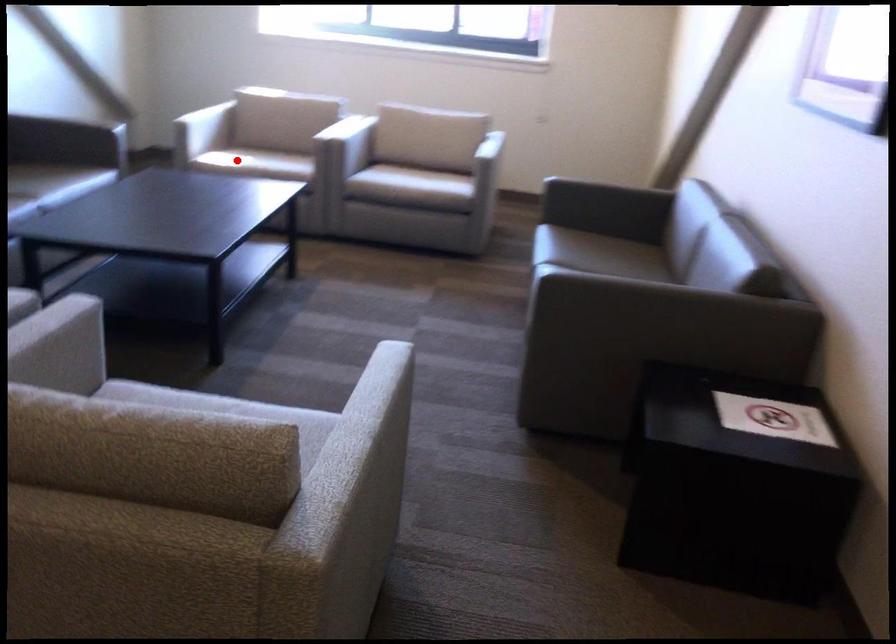
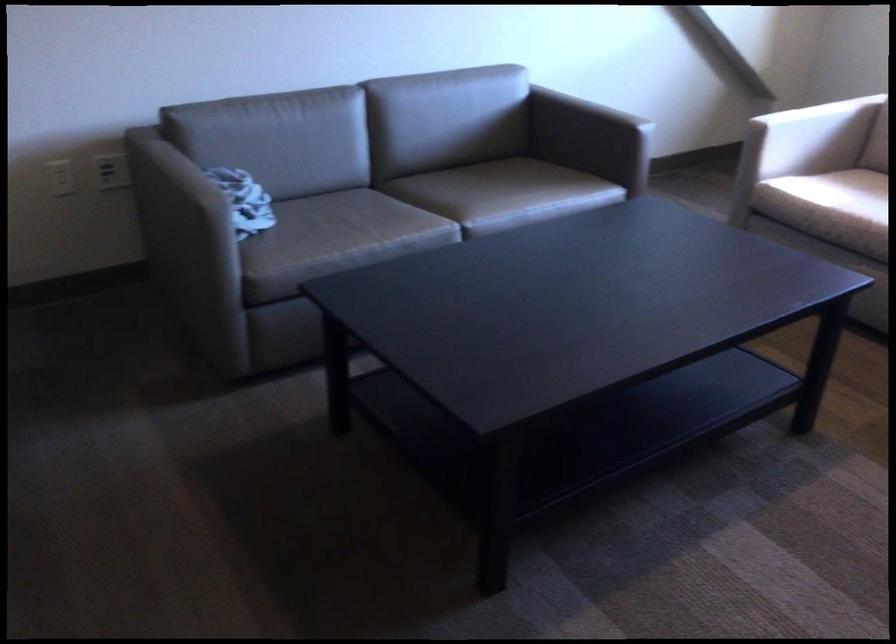
Question: I am providing you with two images of the same scene from different viewpoints. Given a red point in image1, look at the same physical point in image2. Is it:

Choices:
 (A) Closer to the viewpoint
 (B) Farther from the viewpoint

Answer: (A)